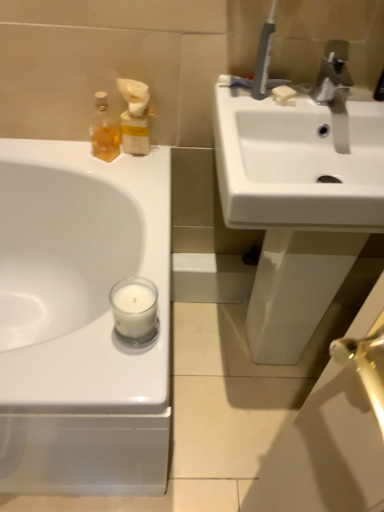
Find the location of a particular element. The width and height of the screenshot is (384, 512). free point behind white matte glass candle at lower center is located at coordinates (152, 250).